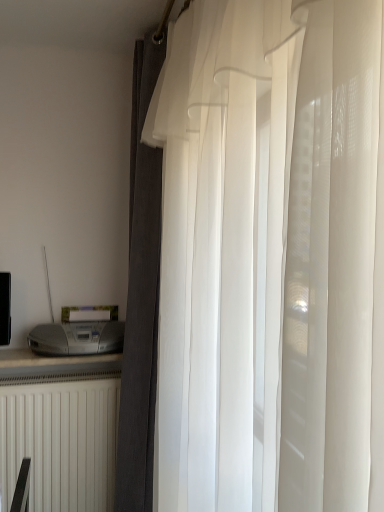
Question: Can translucent white curtain at center, the second curtain from the back, be found inside white matte radiator at lower left?

Choices:
 (A) yes
 (B) no

Answer: (B)

Question: Is white matte radiator at lower left far from translucent white curtain at center, the second curtain from the back?

Choices:
 (A) yes
 (B) no

Answer: (A)

Question: Is white matte radiator at lower left positioned in front of translucent white curtain at center, the second curtain from the back?

Choices:
 (A) no
 (B) yes

Answer: (A)

Question: Can you confirm if white matte radiator at lower left is shorter than translucent white curtain at center, positioned as the 1th curtain in front-to-back order?

Choices:
 (A) yes
 (B) no

Answer: (A)

Question: Would you say white matte radiator at lower left is outside translucent white curtain at center, positioned as the 1th curtain in front-to-back order?

Choices:
 (A) no
 (B) yes

Answer: (B)

Question: Relative to dark gray textured curtain at center, the second curtain from the front, is satin silver printer at lower left in front or behind?

Choices:
 (A) behind
 (B) front

Answer: (A)

Question: Is satin silver printer at lower left taller or shorter than dark gray textured curtain at center, arranged as the 1th curtain when viewed from the back?

Choices:
 (A) short
 (B) tall

Answer: (A)

Question: Would you say satin silver printer at lower left is inside or outside dark gray textured curtain at center, arranged as the 1th curtain when viewed from the back?

Choices:
 (A) inside
 (B) outside

Answer: (B)

Question: Based on their positions, is satin silver printer at lower left located to the left or right of dark gray textured curtain at center, arranged as the 1th curtain when viewed from the back?

Choices:
 (A) left
 (B) right

Answer: (A)

Question: Would you say translucent white curtain at center, positioned as the 1th curtain in front-to-back order, is to the left or to the right of white matte radiator at lower left in the picture?

Choices:
 (A) right
 (B) left

Answer: (A)

Question: From their relative heights in the image, would you say translucent white curtain at center, positioned as the 1th curtain in front-to-back order, is taller or shorter than white matte radiator at lower left?

Choices:
 (A) tall
 (B) short

Answer: (A)

Question: From a real-world perspective, is translucent white curtain at center, positioned as the 1th curtain in front-to-back order, positioned above or below white matte radiator at lower left?

Choices:
 (A) above
 (B) below

Answer: (A)

Question: From the image's perspective, is translucent white curtain at center, the second curtain from the back, above or below white matte radiator at lower left?

Choices:
 (A) above
 (B) below

Answer: (A)

Question: Do you think satin silver printer at lower left is within translucent white curtain at center, positioned as the 1th curtain in front-to-back order, or outside of it?

Choices:
 (A) inside
 (B) outside

Answer: (B)

Question: Is satin silver printer at lower left to the left or to the right of translucent white curtain at center, positioned as the 1th curtain in front-to-back order, in the image?

Choices:
 (A) left
 (B) right

Answer: (A)